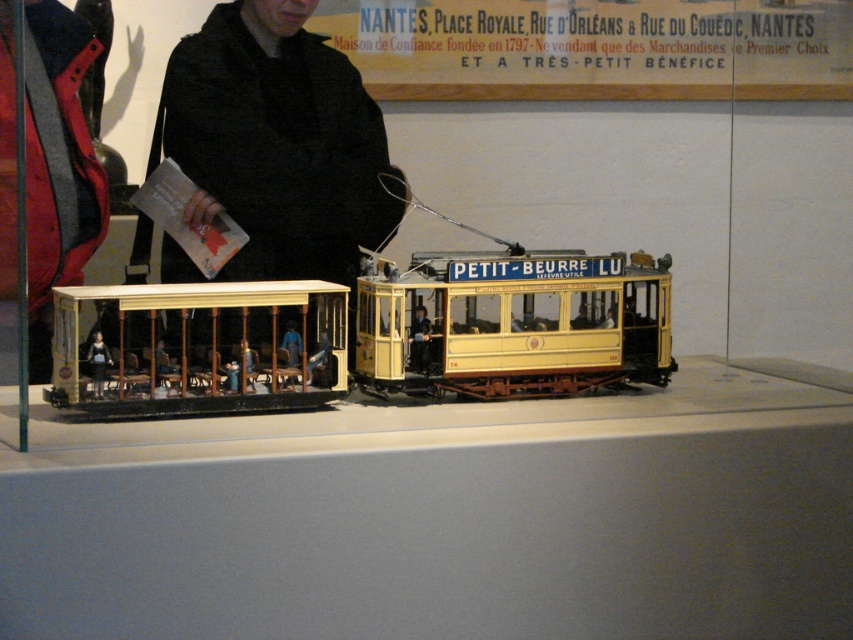
Question: Which is nearer to the light beige wood train car at left?

Choices:
 (A) yellow paper at upper center
 (B) black fabric at center
 (C) yellow matte/light wood train car at center

Answer: (C)

Question: Among these objects, which one is farthest from the camera?

Choices:
 (A) light beige wood train car at left
 (B) black fabric at center

Answer: (B)

Question: Which object appears closest to the camera in this image?

Choices:
 (A) light beige wood train car at left
 (B) yellow matte/light wood train car at center
 (C) black fabric at center

Answer: (A)

Question: Is yellow paper at upper center to the right of light beige wood train car at left from the viewer's perspective?

Choices:
 (A) yes
 (B) no

Answer: (A)

Question: Is yellow paper at upper center further to the viewer compared to yellow matte/light wood train car at center?

Choices:
 (A) yes
 (B) no

Answer: (A)

Question: Where is yellow paper at upper center located in relation to light beige wood train car at left in the image?

Choices:
 (A) left
 (B) right

Answer: (B)